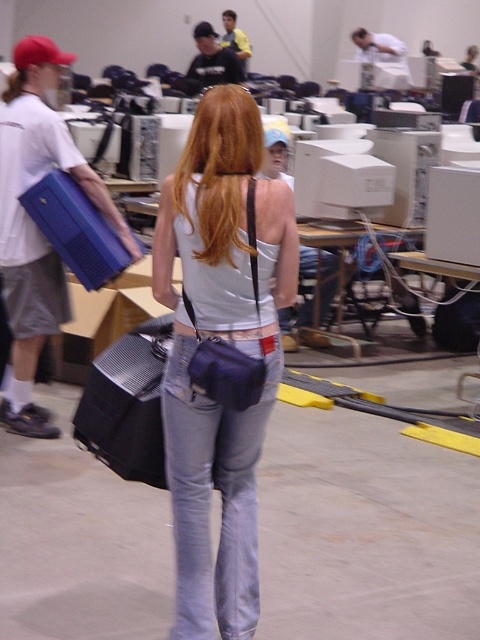
Between denim at center and black fabric suitcase at center, which one has less height?

Standing shorter between the two is black fabric suitcase at center.

Between denim at center and black fabric suitcase at center, which one is positioned higher?

black fabric suitcase at center

Measure the distance between point (193,579) and camera.

The distance of point (193,579) from camera is 3.03 meters.

The height and width of the screenshot is (640, 480). I want to click on denim at center, so click(x=210, y=497).

Does matte blue purse at center appear on the right side of matte blue briefcase at left?

Indeed, matte blue purse at center is positioned on the right side of matte blue briefcase at left.

Does point (204, 458) come behind point (52, 83)?

No, (204, 458) is in front of (52, 83).

The image size is (480, 640). I want to click on matte blue purse at center, so click(220, 352).

The image size is (480, 640). What do you see at coordinates (220, 352) in the screenshot?
I see `matte blue purse at center` at bounding box center [220, 352].

Can you confirm if matte blue purse at center is positioned below black fabric suitcase at center?

No, matte blue purse at center is not below black fabric suitcase at center.

Between point (242, 586) and point (119, 387), which one is positioned behind?

The point (119, 387) is behind.

Image resolution: width=480 pixels, height=640 pixels. What are the coordinates of `matte blue purse at center` in the screenshot? It's located at (220, 352).